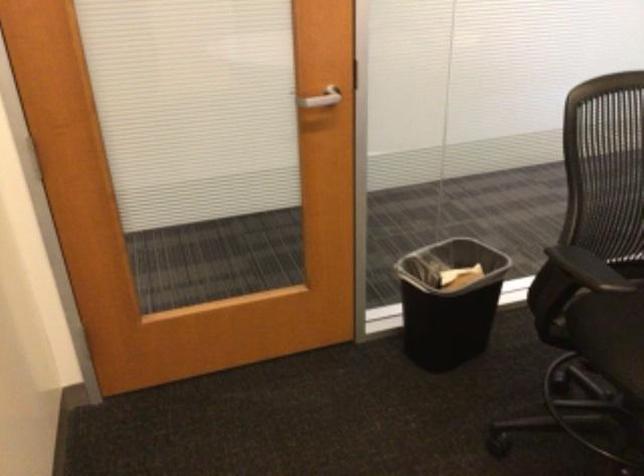
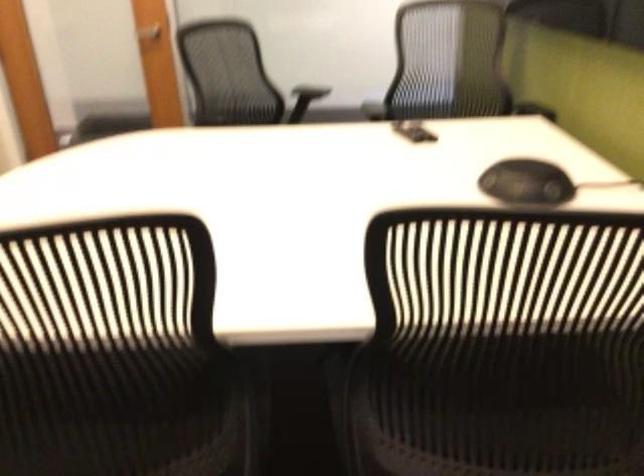
The images are taken continuously from a first-person perspective. In which direction are you moving?

The cameraman moved toward right, backward.